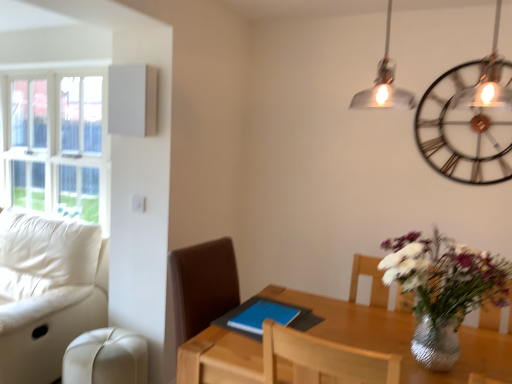
Question: In the image, is blue matte tablet at center positioned in front of or behind white leather couch at left?

Choices:
 (A) front
 (B) behind

Answer: (A)

Question: From their relative heights in the image, would you say blue matte tablet at center is taller or shorter than white leather couch at left?

Choices:
 (A) tall
 (B) short

Answer: (B)

Question: Based on their relative distances, which object is nearer to the metallic/textured wall clock at upper right?

Choices:
 (A) blue matte tablet at center
 (B) white glass window at upper left
 (C) beige leather swivel chair at lower left
 (D) white leather couch at left
 (E) wooden table at center

Answer: (E)

Question: Which object is positioned farthest from the beige leather swivel chair at lower left?

Choices:
 (A) white glass window at upper left
 (B) white leather couch at left
 (C) metallic/textured wall clock at upper right
 (D) blue matte tablet at center
 (E) wooden table at center

Answer: (C)